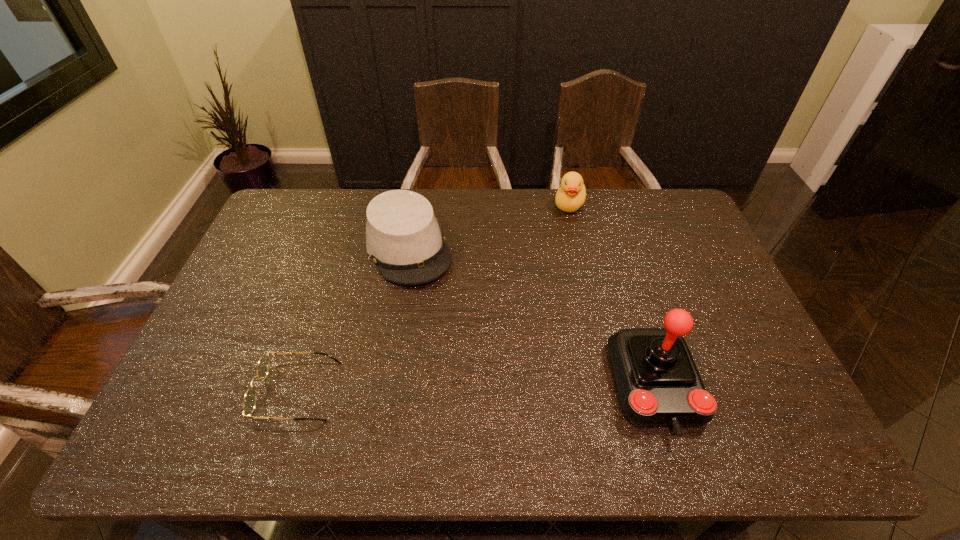
Find the location of `vacant space located at the beak of the duck`. vacant space located at the beak of the duck is located at coordinates (547, 255).

Where is `free region located at the beak of the duck`? This screenshot has height=540, width=960. free region located at the beak of the duck is located at coordinates [551, 248].

Locate an element on the screen. This screenshot has height=540, width=960. hat located in the far edge section of the desktop is located at coordinates (403, 238).

Locate an element on the screen. duck that is at the far edge is located at coordinates (571, 195).

At what (x,y) coordinates should I click in order to perform the action: click on spectacles situated at the near edge. Please return your answer as a coordinate pair (x, y). Looking at the image, I should click on (250, 398).

Locate an element on the screen. This screenshot has width=960, height=540. joystick that is positioned at the near edge is located at coordinates (659, 384).

Find the location of a particular element. vacant region at the far edge of the desktop is located at coordinates (534, 208).

Image resolution: width=960 pixels, height=540 pixels. In the image, there is a desktop. In order to click on vacant space at the near edge in this screenshot , I will do `click(437, 397)`.

In the image, there is a desktop. Identify the location of vacant space at the left edge. The width and height of the screenshot is (960, 540). (251, 301).

You are a GUI agent. You are given a task and a screenshot of the screen. Output one action in this format:
    pyautogui.click(x=<x>, y=<y>)
    Task: Click on the vacant region at the right edge of the desktop
    The image size is (960, 540).
    Given the screenshot: What is the action you would take?
    pyautogui.click(x=703, y=328)